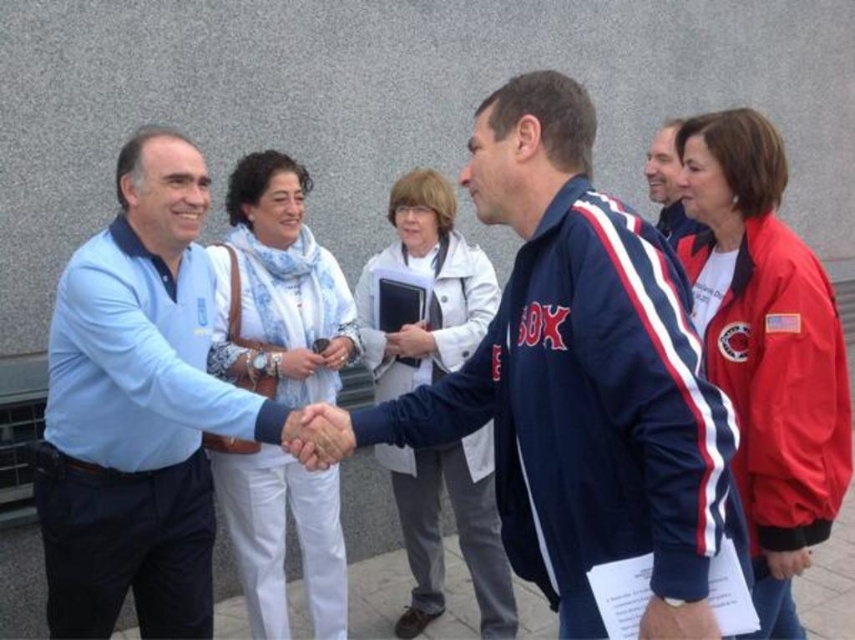
You are standing in front of the gray wall and want to place a small plant between the two points marked as point [446,454] and point [305,372]. Which point should the plant be closer to in order to be closer to the camera?

The plant should be closer to point [446,454] because it is further to the camera than point [305,372].

You are a photographer who needs to capture both the white fabric coat at center and the matte black phone at center in a single frame. Based on their sizes, which object should you focus on first to ensure both are in the frame without cropping?

The white fabric coat at center is taller than the matte black phone at center. To ensure both are in the frame without cropping, focus on the taller object first, which is the white fabric coat at center, as it requires more vertical space.

From the picture: You are a photographer standing in front of the scene. You need to capture a photo that includes both the red jacket at right and the white fabric coat at center. Which object should you focus on first to ensure both are in frame?

The red jacket at right is shorter than the white fabric coat at center, so you should focus on the white fabric coat at center first to ensure both are in frame.